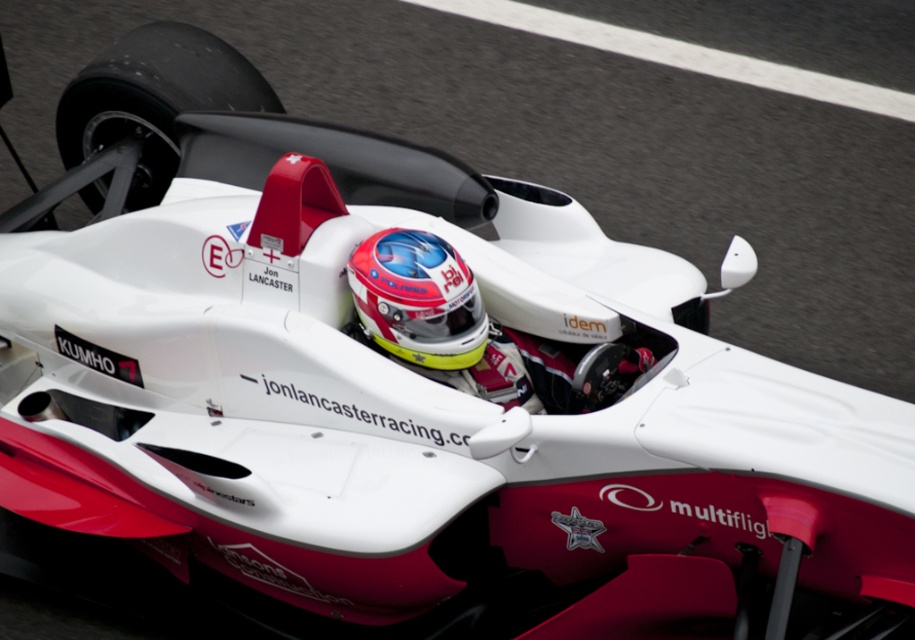
You are a race engineer observing the Formula One car in motion. You notice two helmets inside the cockpit. How far apart are the shiny white helmet at center and the matte red helmet at center?

The shiny white helmet at center is 1.67 inches from matte red helmet at center.

You are a race engineer analyzing the car setup. You notice two points on the car body at coordinates point (478, 323) and point (466, 349). Which point is positioned further back relative to the car?

Point (478, 323) is behind point (466, 349), so it is positioned further back relative to the car.